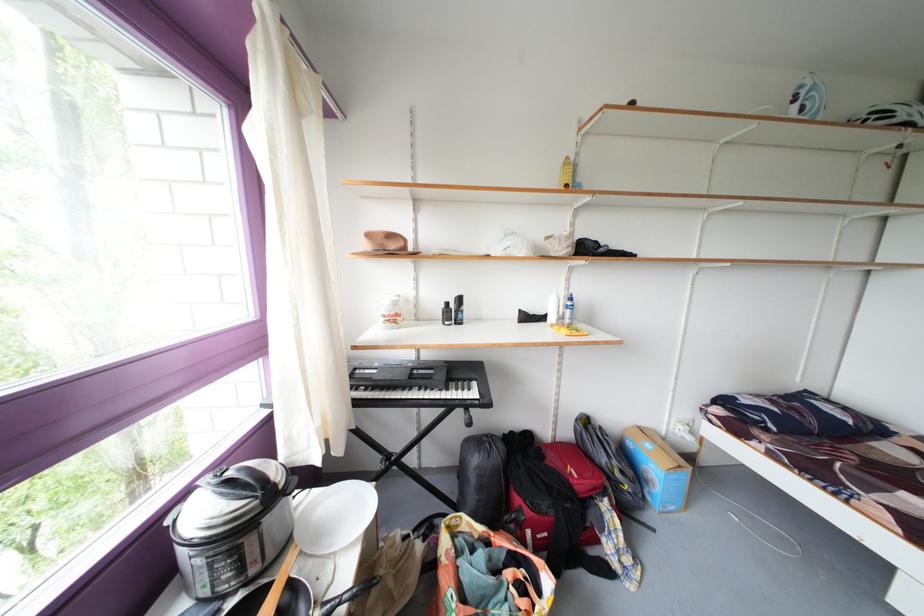
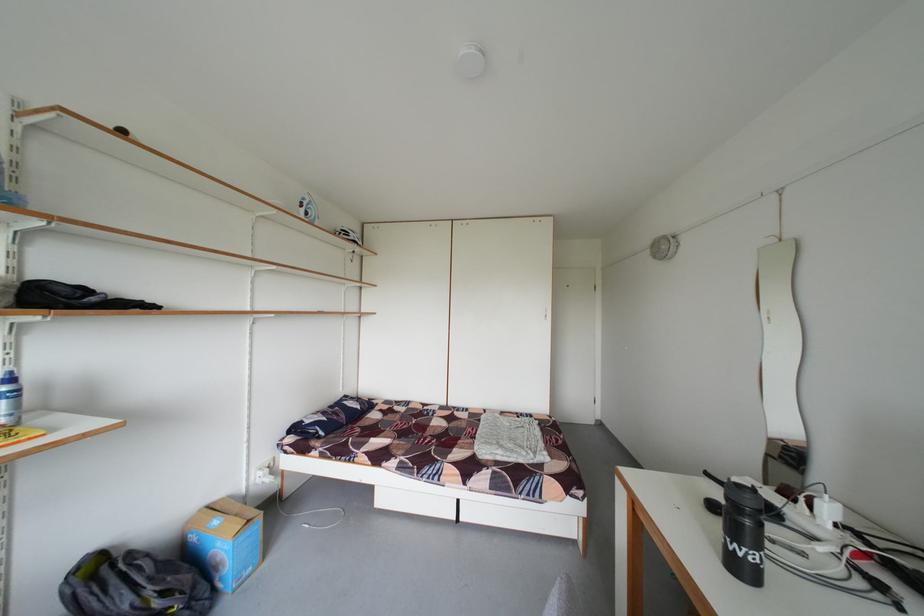
Where in the second image is the point corresponding to (x=812, y=99) from the first image?

(315, 209)